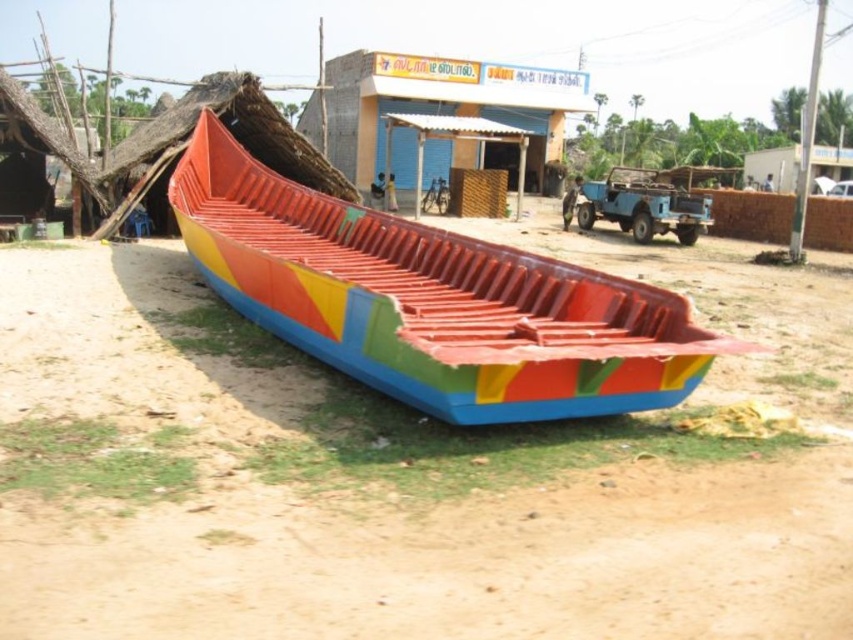
Question: Which of these objects is positioned closest to the blue metallic truck at center?

Choices:
 (A) multicolored plastic boat at center
 (B) dirt field at center

Answer: (A)

Question: Does dirt field at center have a lesser width compared to blue metallic truck at center?

Choices:
 (A) yes
 (B) no

Answer: (B)

Question: Which of the following is the closest to the observer?

Choices:
 (A) dirt field at center
 (B) matte blue building at center
 (C) multicolored plastic boat at center
 (D) blue metallic truck at center

Answer: (A)

Question: Can you confirm if multicolored plastic boat at center is positioned to the left of blue metallic truck at center?

Choices:
 (A) yes
 (B) no

Answer: (A)

Question: Observing the image, what is the correct spatial positioning of multicolored plastic boat at center in reference to blue metallic truck at center?

Choices:
 (A) below
 (B) above

Answer: (A)

Question: Which of the following is the closest to the observer?

Choices:
 (A) matte blue building at center
 (B) blue metallic truck at center
 (C) dirt field at center

Answer: (C)